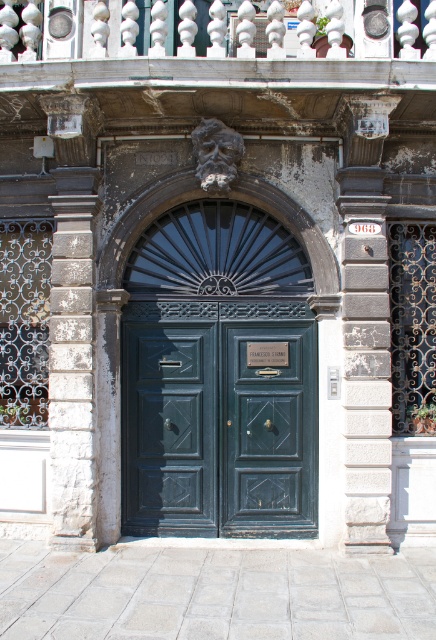
Between white marble railing at upper center and matte green door at center, which one has more height?

matte green door at center

Measure the distance between white marble railing at upper center and camera.

They are 6.39 meters apart.

The width and height of the screenshot is (436, 640). In order to click on white marble railing at upper center in this screenshot , I will do `click(214, 42)`.

Is point (166, 468) farther from camera compared to point (282, 387)?

Yes, point (166, 468) is behind point (282, 387).

Which is in front, point (269, 452) or point (305, 516)?

Point (305, 516) is in front.

You are a GUI agent. You are given a task and a screenshot of the screen. Output one action in this format:
    pyautogui.click(x=<x>, y=<y>)
    Task: Click on the green polished wood door at center
    
    Given the screenshot: What is the action you would take?
    pyautogui.click(x=218, y=419)

Can you confirm if green polished wood door at center is shorter than white stone column at left?

Indeed, green polished wood door at center has a lesser height compared to white stone column at left.

Is point (316, 396) less distant than point (71, 380)?

No.

Where is `green polished wood door at center`? The image size is (436, 640). green polished wood door at center is located at coordinates (218, 419).